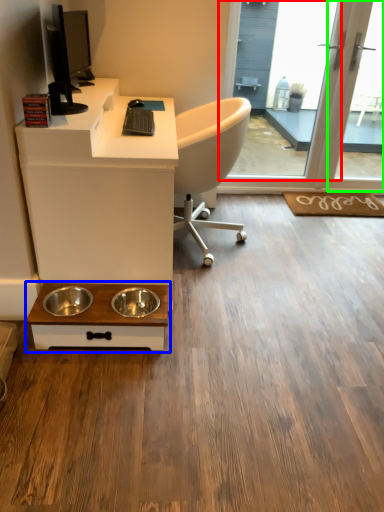
Question: Considering the real-world distances, which object is farthest from screen door (highlighted by a red box)? table (highlighted by a blue box) or screen door (highlighted by a green box)?

Choices:
 (A) table
 (B) screen door

Answer: (A)